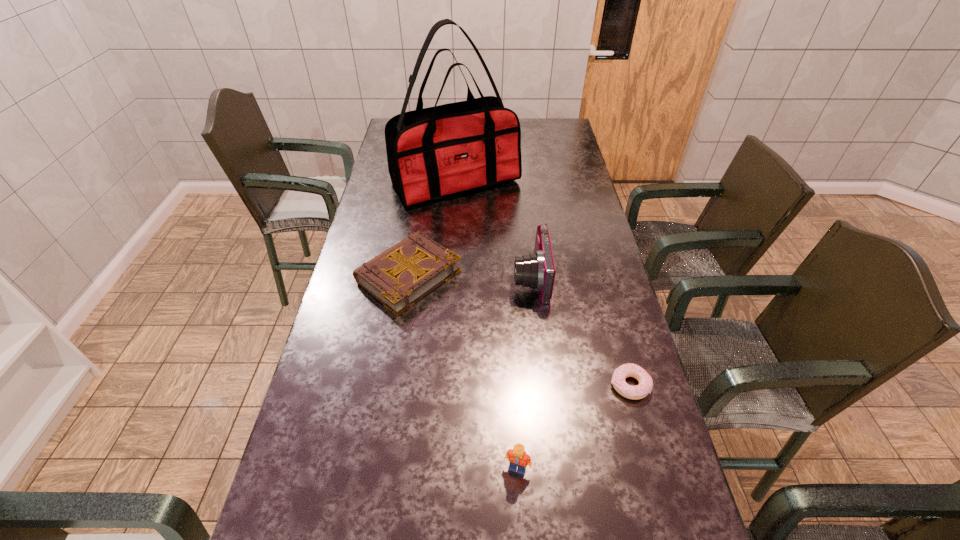
I want to click on the farthest object, so click(433, 153).

Where is `the tallest object`? This screenshot has width=960, height=540. the tallest object is located at coordinates (433, 153).

In order to click on camera in this screenshot , I will do `click(537, 271)`.

I want to click on the nearest object, so click(517, 457).

Find the location of `Lego`. Lego is located at coordinates (517, 457).

Where is `the fourth tallest object`? the fourth tallest object is located at coordinates (399, 277).

At what (x,y) coordinates should I click in order to perform the action: click on doughnut. Please return your answer as a coordinate pair (x, y). The height and width of the screenshot is (540, 960). Looking at the image, I should click on (644, 388).

The height and width of the screenshot is (540, 960). What are the coordinates of `the shortest object` in the screenshot? It's located at (644, 388).

Where is `free point located 0.310m on the back of the farthest object`? free point located 0.310m on the back of the farthest object is located at coordinates (460, 124).

The height and width of the screenshot is (540, 960). In order to click on vacant space situated on the front-facing side of the camera in this screenshot , I will do `click(475, 279)`.